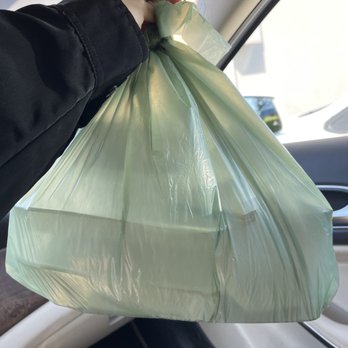
The width and height of the screenshot is (348, 348). Find the location of `interior door`. interior door is located at coordinates (310, 161).